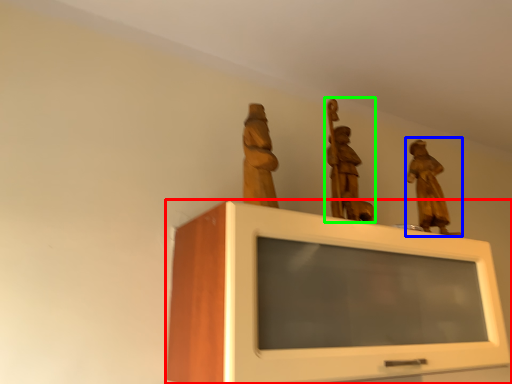
Question: Estimate the real-world distances between objects in this image. Which object is closer to furniture (highlighted by a red box), sculpture (highlighted by a blue box) or sculpture (highlighted by a green box)?

Choices:
 (A) sculpture
 (B) sculpture

Answer: (B)